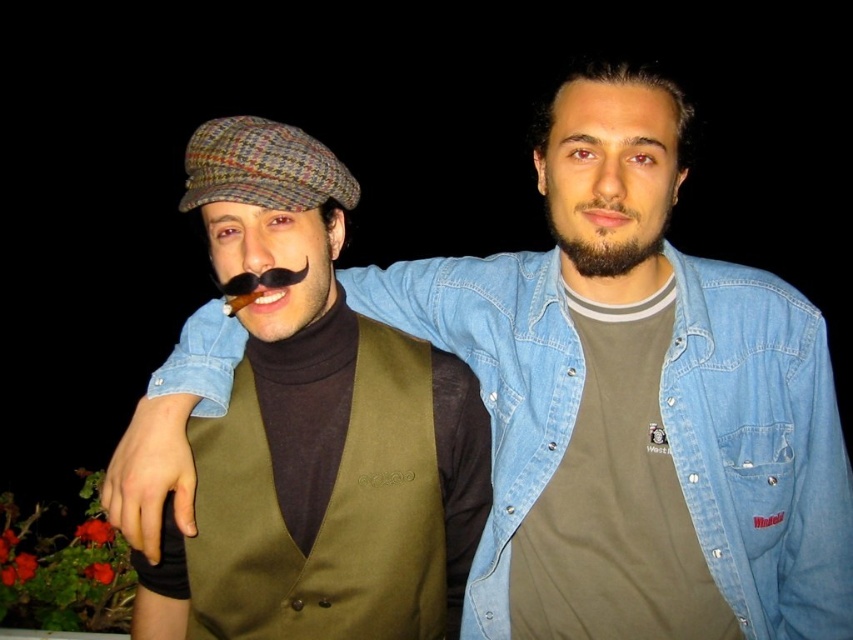
Question: Does matte brown cap at center lie in front of dark brown stubble at center?

Choices:
 (A) yes
 (B) no

Answer: (A)

Question: Based on their relative distances, which object is nearer to the dark brown stubble at center?

Choices:
 (A) faded denim jacket at upper center
 (B) matte brown cap at center

Answer: (A)

Question: Estimate the real-world distances between objects in this image. Which object is farther from the faded denim jacket at upper center?

Choices:
 (A) dark brown stubble at center
 (B) matte brown cap at center

Answer: (A)

Question: Is matte brown cap at center positioned behind dark brown stubble at center?

Choices:
 (A) no
 (B) yes

Answer: (A)

Question: Is matte brown cap at center smaller than faded denim jacket at upper center?

Choices:
 (A) yes
 (B) no

Answer: (A)

Question: Which object is the closest to the faded denim jacket at upper center?

Choices:
 (A) matte brown cap at center
 (B) dark brown stubble at center

Answer: (A)